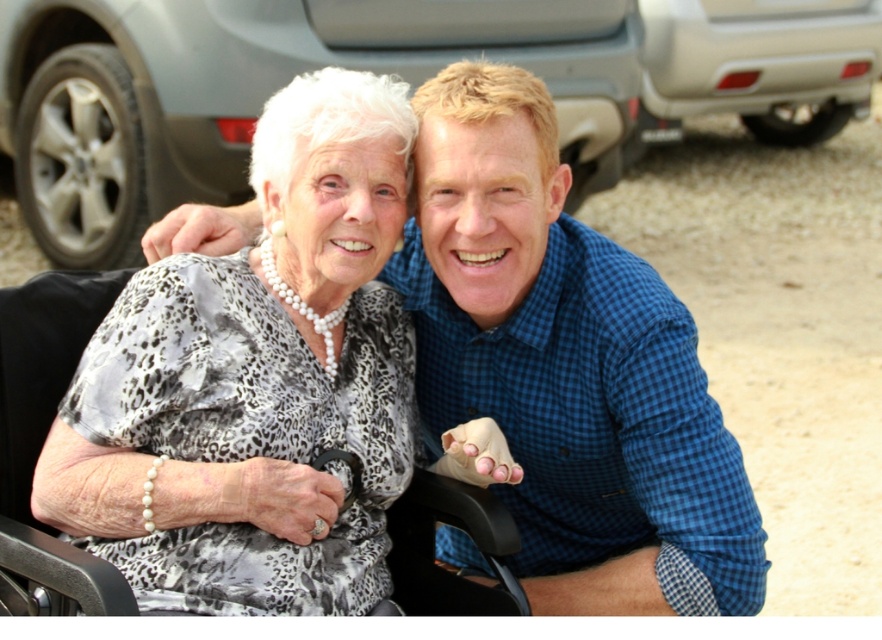
Question: In this image, where is white pearl necklace at upper left located relative to silver metallic car at upper right?

Choices:
 (A) right
 (B) left

Answer: (B)

Question: Which point is closer to the camera?

Choices:
 (A) metallic gray car at upper center
 (B) white pearl necklace at upper left
 (C) blue checkered shirt at center

Answer: (B)

Question: Among these objects, which one is nearest to the camera?

Choices:
 (A) silver metallic car at upper right
 (B) blue checkered shirt at center
 (C) white pearl necklace at upper left
 (D) metallic gray car at upper center

Answer: (C)

Question: Which of the following is the closest to the observer?

Choices:
 (A) (447, 26)
 (B) (402, 86)

Answer: (B)

Question: Is blue checkered shirt at center further to the viewer compared to silver metallic car at upper right?

Choices:
 (A) yes
 (B) no

Answer: (B)

Question: Can you confirm if white pearl necklace at upper left is thinner than metallic gray car at upper center?

Choices:
 (A) no
 (B) yes

Answer: (B)